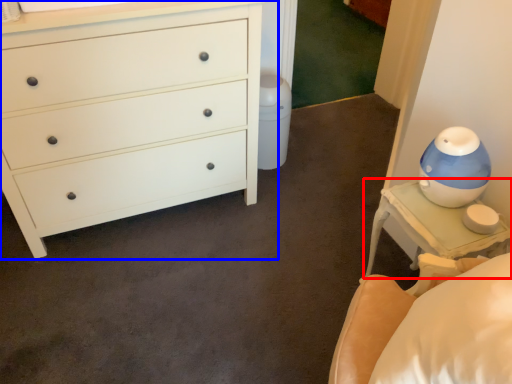
Question: Which object is closer to the camera taking this photo, nightstand (highlighted by a red box) or chest of drawers (highlighted by a blue box)?

Choices:
 (A) nightstand
 (B) chest of drawers

Answer: (B)